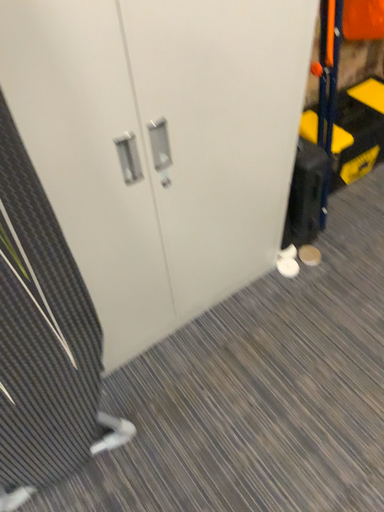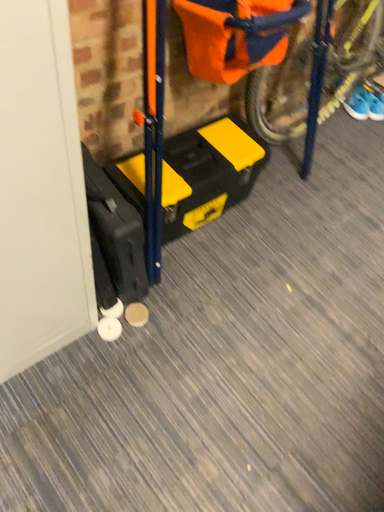
Question: How did the camera likely rotate when shooting the video?

Choices:
 (A) rotated right
 (B) rotated left

Answer: (A)